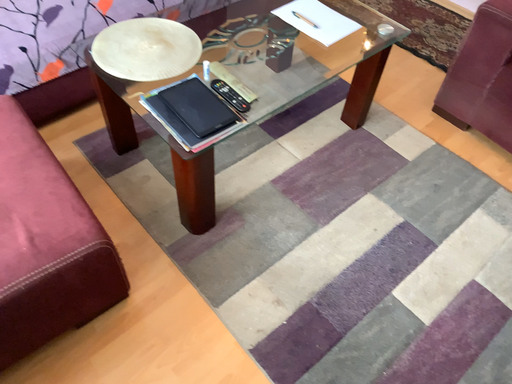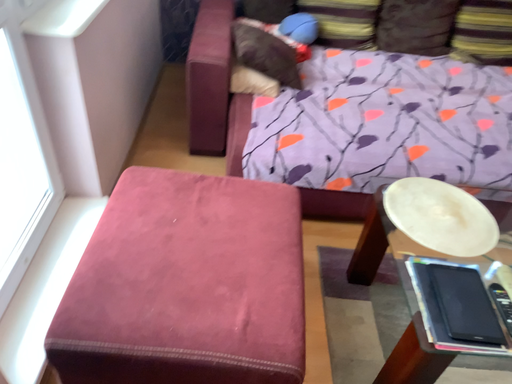
Question: Which way did the camera rotate in the video?

Choices:
 (A) rotated right
 (B) rotated left

Answer: (B)